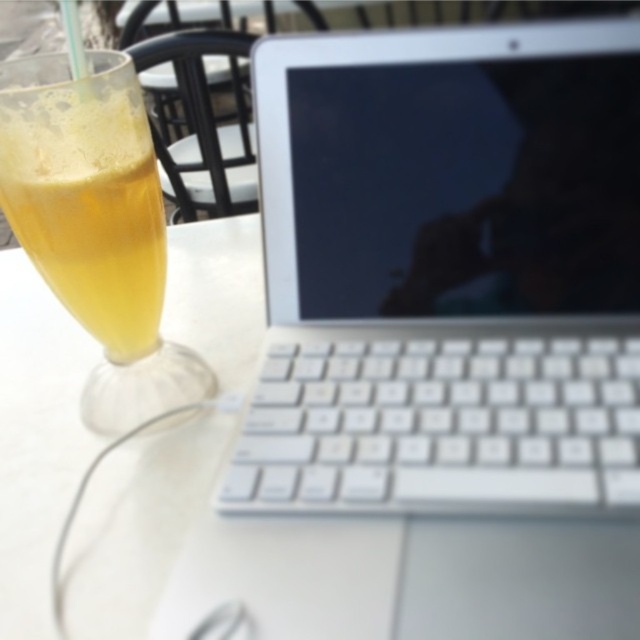
Who is more forward, (x=477, y=100) or (x=132, y=182)?

Point (x=477, y=100) is in front.

Is point (285, 116) in front of point (48, 97)?

That is False.

Locate an element on the screen. Image resolution: width=640 pixels, height=640 pixels. white plastic laptop at center is located at coordinates (448, 273).

Who is lower down, white plastic laptop at center or white plastic table at center?

white plastic table at center

Does white plastic laptop at center appear over white plastic table at center?

Indeed, white plastic laptop at center is positioned over white plastic table at center.

Is point (433, 172) farther from viewer compared to point (477, 582)?

Yes, it is behind point (477, 582).

Image resolution: width=640 pixels, height=640 pixels. Identify the location of white plastic laptop at center. (448, 273).

Is white plastic table at center positioned behind translucent glass at left?

No, white plastic table at center is in front of translucent glass at left.

Between white plastic table at center and translucent glass at left, which one is positioned lower?

Positioned lower is white plastic table at center.

Between point (173, 468) and point (148, 339), which one is positioned in front?

Point (173, 468) is in front.

Identify the location of white plastic table at center. Image resolution: width=640 pixels, height=640 pixels. (35, 438).